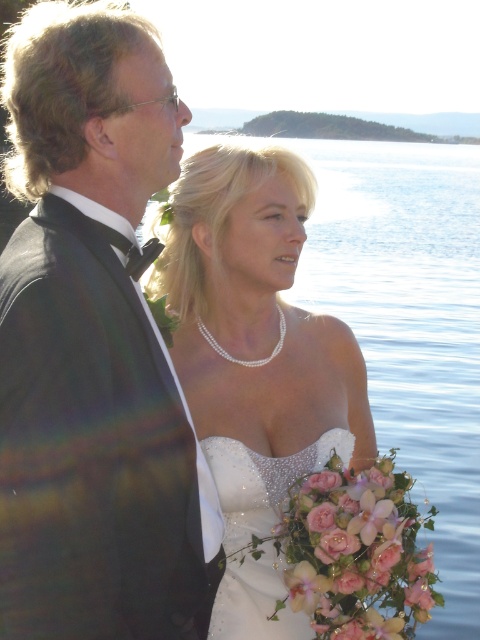
Question: Does shiny black tuxedo at left have a greater width compared to pearl necklace at center?

Choices:
 (A) no
 (B) yes

Answer: (A)

Question: Where is shiny black tuxedo at left located in relation to sparkly white dress at center in the image?

Choices:
 (A) left
 (B) right

Answer: (A)

Question: Which of the following is the farthest from the observer?

Choices:
 (A) (264, 372)
 (B) (132, 264)
 (C) (256, 522)

Answer: (A)

Question: Does pearl necklace at center lie in front of sparkly white dress at center?

Choices:
 (A) no
 (B) yes

Answer: (A)

Question: Which object is the farthest from the sparkly white dress at center?

Choices:
 (A) shiny black tuxedo at left
 (B) pearl necklace at center

Answer: (A)

Question: Among these points, which one is nearest to the camera?

Choices:
 (A) (3, 618)
 (B) (235, 493)

Answer: (A)